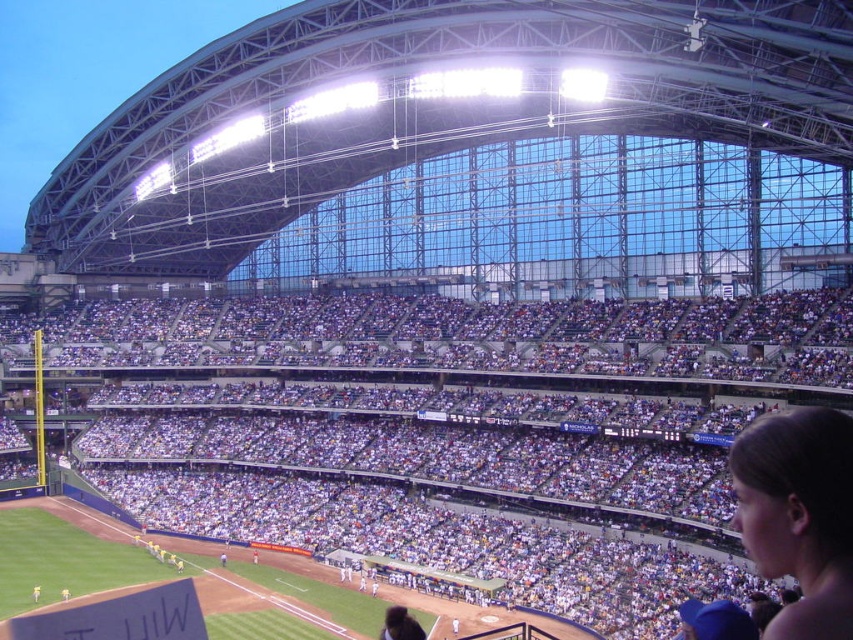
Question: Which object appears closest to the camera in this image?

Choices:
 (A) brown hair at upper right
 (B) white fabric crowd at center

Answer: (A)

Question: Does white fabric crowd at center lie in front of brown hair at upper right?

Choices:
 (A) no
 (B) yes

Answer: (A)

Question: Can you confirm if white fabric crowd at center is wider than brown hair at upper right?

Choices:
 (A) no
 (B) yes

Answer: (B)

Question: Is white fabric crowd at center smaller than brown hair at upper right?

Choices:
 (A) yes
 (B) no

Answer: (B)